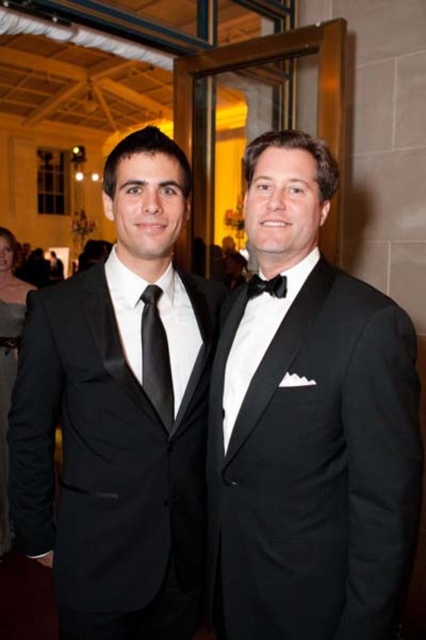
Question: Among these objects, which one is nearest to the camera?

Choices:
 (A) black satin tie at center
 (B) matte black dress at lower left
 (C) black satin bow tie at center

Answer: (C)

Question: Among these points, which one is nearest to the camera?

Choices:
 (A) (250, 294)
 (B) (2, 532)
 (C) (222, 611)

Answer: (C)

Question: Is black satin tie at center smaller than black satin bow tie at center?

Choices:
 (A) no
 (B) yes

Answer: (A)

Question: Which object is positioned farthest from the black satin tuxedo at center?

Choices:
 (A) black satin bow tie at center
 (B) matte black suit at center

Answer: (A)

Question: Does black satin tuxedo at center appear under matte black dress at lower left?

Choices:
 (A) yes
 (B) no

Answer: (B)

Question: Does matte black suit at center have a larger size compared to black satin tie at center?

Choices:
 (A) yes
 (B) no

Answer: (A)